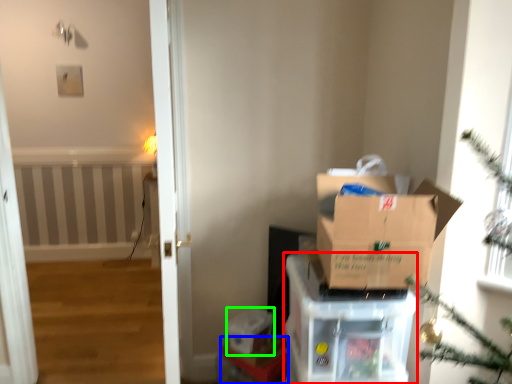
Question: Which object is the farthest from cardboard box (highlighted by a red box)? Choose among these: furniture (highlighted by a blue box) or storage box (highlighted by a green box).

Choices:
 (A) furniture
 (B) storage box

Answer: (B)